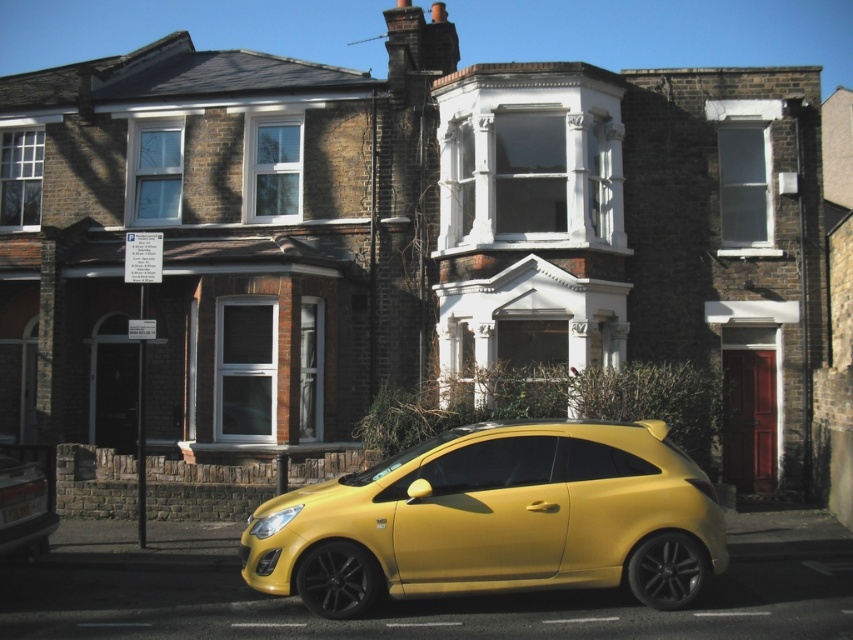
Describe the element at coordinates (38, 464) in the screenshot. Image resolution: width=853 pixels, height=640 pixels. I see `metallic yellow hatchback at lower left` at that location.

Is metallic yellow hatchback at lower left to the left of yellow plastic license plate at lower left from the viewer's perspective?

Indeed, metallic yellow hatchback at lower left is positioned on the left side of yellow plastic license plate at lower left.

Locate an element on the screen. Image resolution: width=853 pixels, height=640 pixels. metallic yellow hatchback at lower left is located at coordinates (38, 464).

Which is more to the left, yellow matte car at lower center or metallic yellow hatchback at lower left?

metallic yellow hatchback at lower left

Is point (672, 563) farther from viewer compared to point (45, 448)?

No, (672, 563) is closer to viewer.

I want to click on yellow matte car at lower center, so click(x=496, y=518).

Is yellow matte car at lower center to the right of yellow plastic license plate at lower left from the viewer's perspective?

Correct, you'll find yellow matte car at lower center to the right of yellow plastic license plate at lower left.

Who is more distant from viewer, (548, 554) or (4, 515)?

The point (4, 515) is behind.

Identify the location of yellow matte car at lower center. (496, 518).